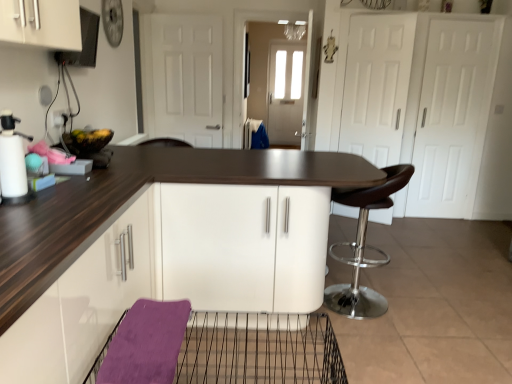
Question: Does white matte spray bottle at left turn towards brown leather stool at right?

Choices:
 (A) yes
 (B) no

Answer: (B)

Question: From a real-world perspective, does white matte spray bottle at left sit lower than brown leather stool at right?

Choices:
 (A) yes
 (B) no

Answer: (B)

Question: Does white matte spray bottle at left have a lesser height compared to brown leather stool at right?

Choices:
 (A) no
 (B) yes

Answer: (B)

Question: Does white matte spray bottle at left have a lesser width compared to brown leather stool at right?

Choices:
 (A) no
 (B) yes

Answer: (B)

Question: From a real-world perspective, does white matte spray bottle at left stand above brown leather stool at right?

Choices:
 (A) yes
 (B) no

Answer: (A)

Question: Is white matte spray bottle at left not near brown leather stool at right?

Choices:
 (A) no
 (B) yes

Answer: (B)

Question: Does white matte door at center have a larger size compared to white matte spray bottle at left?

Choices:
 (A) yes
 (B) no

Answer: (A)

Question: Is white matte door at center at the right side of white matte spray bottle at left?

Choices:
 (A) yes
 (B) no

Answer: (A)

Question: Considering the relative sizes of white matte door at center and white matte spray bottle at left in the image provided, is white matte door at center smaller than white matte spray bottle at left?

Choices:
 (A) yes
 (B) no

Answer: (B)

Question: Is the surface of white matte door at center in direct contact with white matte spray bottle at left?

Choices:
 (A) no
 (B) yes

Answer: (A)

Question: Considering the relative sizes of white matte door at center and white matte spray bottle at left in the image provided, is white matte door at center shorter than white matte spray bottle at left?

Choices:
 (A) yes
 (B) no

Answer: (B)

Question: Can you confirm if white matte door at center is thinner than white matte spray bottle at left?

Choices:
 (A) no
 (B) yes

Answer: (B)

Question: Are brown leather stool at right and wire mesh basket at lower center making contact?

Choices:
 (A) yes
 (B) no

Answer: (B)